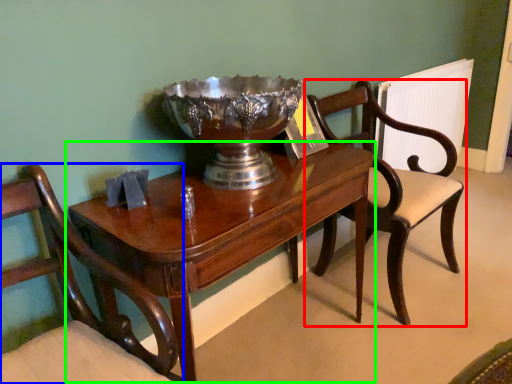
Question: Which object is the farthest from chair (highlighted by a red box)? Choose among these: chair (highlighted by a blue box) or table (highlighted by a green box).

Choices:
 (A) chair
 (B) table

Answer: (A)